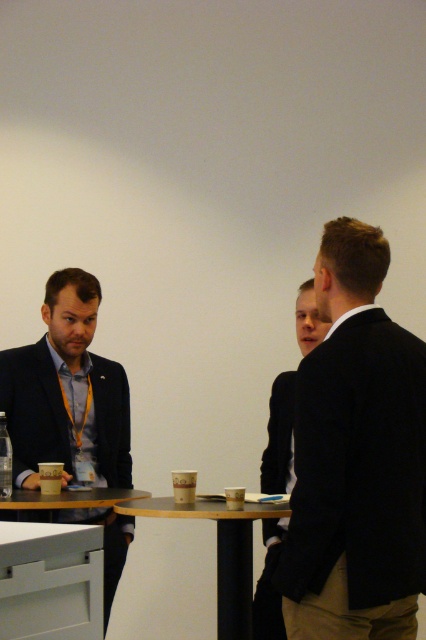
Based on the scene description, which object is wider, the matte black suit at left or the dark suit jacket at center?

The matte black suit at left is wider than the dark suit jacket at center.

You are organizing a photo shoot and need to ensure that the matte black suit at left and the white glossy table at lower left are visible in the frame. Given their sizes, which object should you prioritize positioning closer to the camera to ensure clarity?

The matte black suit at left has a larger size compared to the white glossy table at lower left, so you should prioritize positioning the matte black suit at left closer to the camera to ensure clarity.

You are a service robot with a 12 inch wide tray. You need to deliver a coffee cup from the matte black suit at left to the white glossy table at lower left. Can you pass through the space between them?

The distance between the matte black suit at left and the white glossy table at lower left is 10.61 inches. Since your tray is 12 inches wide, it is wider than the available space. Therefore, you cannot pass through the space between them.